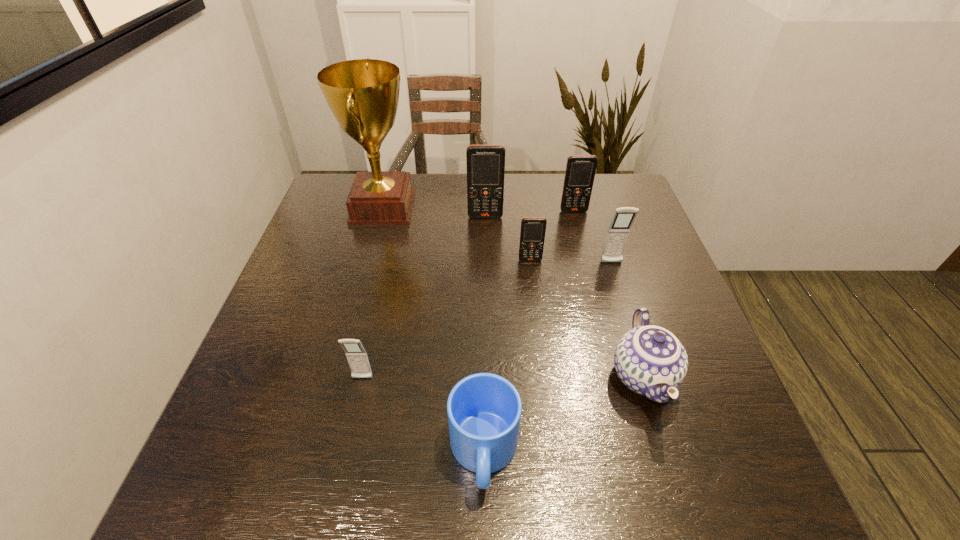
Where is `the tallest object`? The image size is (960, 540). the tallest object is located at coordinates (363, 94).

Locate an element on the screen. gold award is located at coordinates (363, 94).

This screenshot has width=960, height=540. What are the coordinates of `the fourth cellular telephone from right to left` in the screenshot? It's located at (485, 163).

Locate an element on the screen. the leftmost orange cellular telephone is located at coordinates (485, 163).

Where is `the right gray cellular telephone`? the right gray cellular telephone is located at coordinates (618, 231).

Where is `the farther gray cellular telephone`? This screenshot has width=960, height=540. the farther gray cellular telephone is located at coordinates tap(618, 231).

At what (x,y) coordinates should I click in order to perform the action: click on the second smallest orange cellular telephone. Please return your answer as a coordinate pair (x, y). This screenshot has width=960, height=540. Looking at the image, I should click on (580, 172).

Identify the location of the farthest orange cellular telephone. (580, 172).

Find the location of a particular element. the fourth object from right to left is located at coordinates (532, 235).

Find the location of a particular element. the nearest orange cellular telephone is located at coordinates (532, 235).